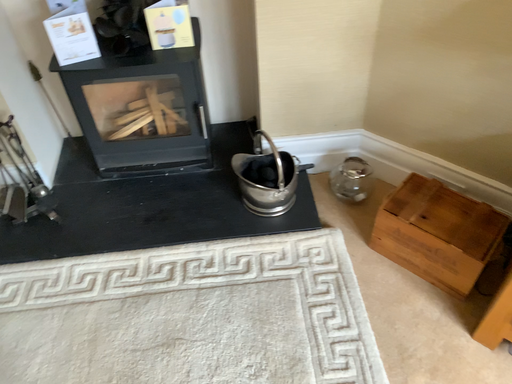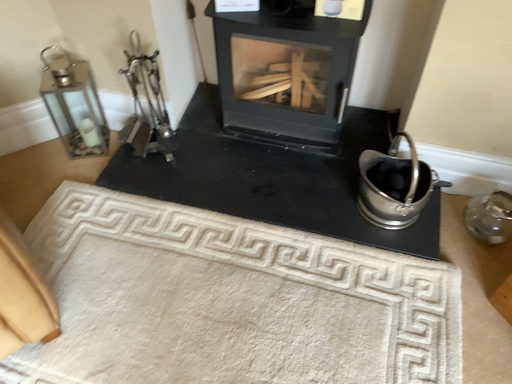
Question: Which way did the camera rotate in the video?

Choices:
 (A) rotated right
 (B) rotated left

Answer: (B)